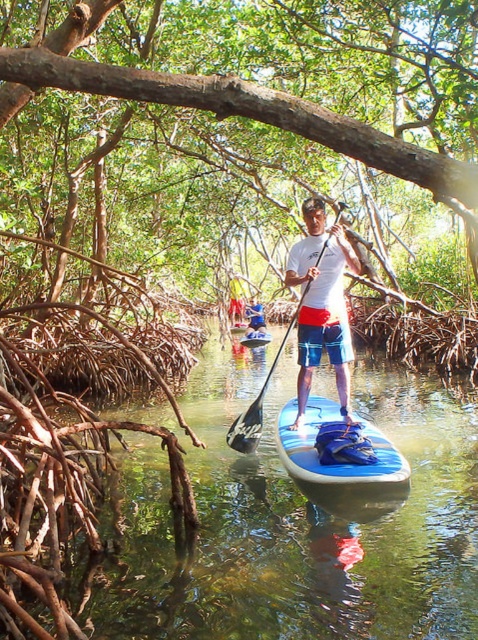
Between point (260, 323) and point (250, 346), which one is positioned behind?

The point (260, 323) is more distant.

Between white matte paddle at center and blue glossy canoe at center, which one appears on the right side from the viewer's perspective?

blue glossy canoe at center is more to the right.

Is point (261, 314) farther from viewer compared to point (246, 339)?

Yes, it is.

Identify the location of white matte paddle at center. (254, 317).

Does blue inflatable paddleboard at center have a greater width compared to black plastic paddle at center?

Incorrect, blue inflatable paddleboard at center's width does not surpass black plastic paddle at center's.

Who is lower down, blue inflatable paddleboard at center or black plastic paddle at center?

Positioned lower is blue inflatable paddleboard at center.

Is point (368, 480) positioned in front of point (242, 445)?

Yes.

I want to click on blue inflatable paddleboard at center, so click(x=334, y=465).

The image size is (478, 640). What do you see at coordinates (322, 305) in the screenshot?
I see `white matte paddleboard at center` at bounding box center [322, 305].

Locate an element on the screen. Image resolution: width=478 pixels, height=640 pixels. white matte paddleboard at center is located at coordinates (322, 305).

Locate an element on the screen. This screenshot has height=640, width=478. white matte paddleboard at center is located at coordinates click(322, 305).

You are a GUI agent. You are given a task and a screenshot of the screen. Output one action in this format:
    pyautogui.click(x=<x>, y=<y>)
    Task: Click on the white matte paddleboard at center
    This screenshot has height=640, width=478.
    Given the screenshot: What is the action you would take?
    pyautogui.click(x=322, y=305)